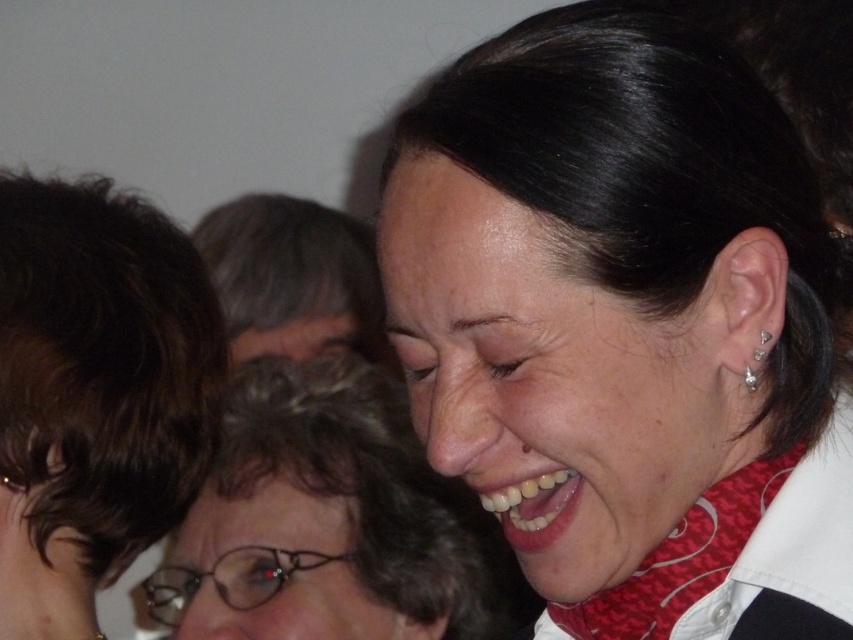
Question: Is matte black hair at upper center thinner than silver metallic stud at ear?

Choices:
 (A) yes
 (B) no

Answer: (B)

Question: Considering the real-world distances, which object is farthest from the matte black hair at center?

Choices:
 (A) dark brown hair at left
 (B) matte black hair at upper right
 (C) matte black hair at upper center
 (D) silver metallic stud at ear

Answer: (D)

Question: Which is nearer to the matte black hair at upper right?

Choices:
 (A) dark brown hair at left
 (B) matte black hair at center
 (C) diamondearring at right
 (D) silver metallic stud at ear

Answer: (C)

Question: Observing the image, what is the correct spatial positioning of silver metallic stud at ear in reference to diamondearring at right?

Choices:
 (A) left
 (B) right

Answer: (B)

Question: Is matte black hair at center smaller than diamondearring at right?

Choices:
 (A) yes
 (B) no

Answer: (B)

Question: Considering the real-world distances, which object is closest to the matte black hair at upper center?

Choices:
 (A) diamondearring at right
 (B) dark brown hair at left
 (C) matte black hair at upper right

Answer: (B)